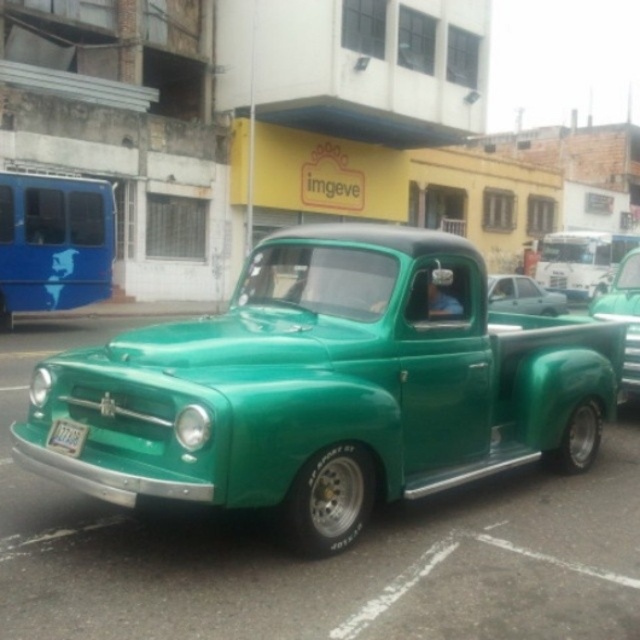
Question: Does green matte truck at left appear on the left side of green matte truck at center?

Choices:
 (A) yes
 (B) no

Answer: (A)

Question: Can you confirm if matte green pickup truck at center is wider than green matte license plate at front?

Choices:
 (A) no
 (B) yes

Answer: (B)

Question: Where is metallic green truck at center located in relation to green matte license plate at front in the image?

Choices:
 (A) left
 (B) right

Answer: (B)

Question: Among these objects, which one is farthest from the camera?

Choices:
 (A) green matte truck at left
 (B) metallic green truck at center

Answer: (A)

Question: Considering the real-world distances, which object is closest to the matte green pickup truck at center?

Choices:
 (A) green matte license plate at front
 (B) metallic green truck at center
 (C) green matte truck at center
 (D) green matte truck at left

Answer: (C)

Question: Which point is closer to the camera?

Choices:
 (A) green matte license plate at front
 (B) metallic green truck at center

Answer: (B)